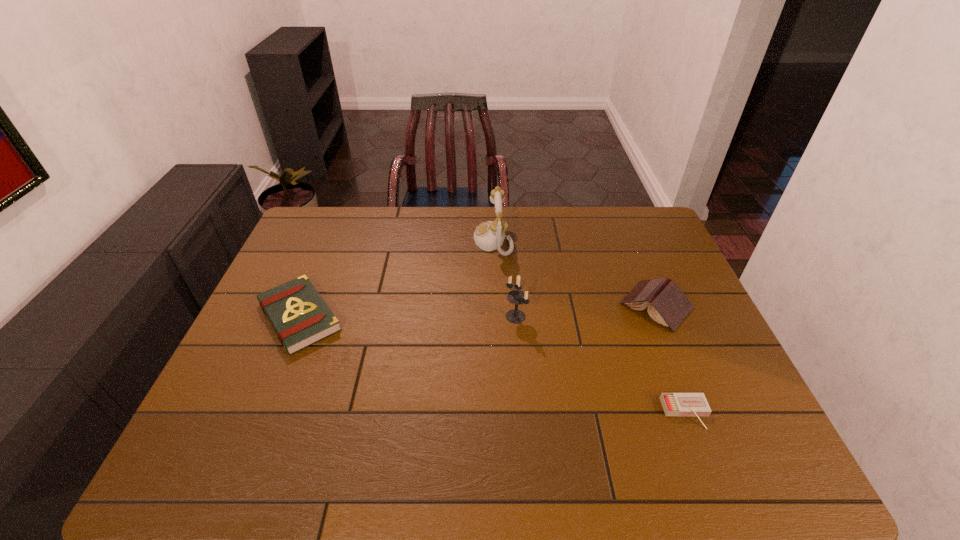
Where is `vacant area that lies between the shortest object and the telephone`? vacant area that lies between the shortest object and the telephone is located at coordinates (589, 327).

Find the location of a particular element. The width and height of the screenshot is (960, 540). free space between the third tallest object and the shorter book is located at coordinates (478, 311).

Where is `free space between the right book and the candle holder`? This screenshot has height=540, width=960. free space between the right book and the candle holder is located at coordinates (586, 311).

Identify the location of empty space that is in between the candle holder and the telephone. This screenshot has height=540, width=960. (504, 279).

At what (x,y) coordinates should I click in order to perform the action: click on vacant point located between the taller book and the nearest object. Please return your answer as a coordinate pair (x, y). This screenshot has width=960, height=540. Looking at the image, I should click on (671, 360).

This screenshot has width=960, height=540. What are the coordinates of `vacant space that's between the candle holder and the telephone` in the screenshot? It's located at (504, 279).

Select which object appears as the closest to the candle holder. Please provide its 2D coordinates. Your answer should be formatted as a tuple, i.e. [(x, y)], where the tuple contains the x and y coordinates of a point satisfying the conditions above.

[(490, 235)]

The height and width of the screenshot is (540, 960). I want to click on object identified as the closest to the second shortest object, so click(x=490, y=235).